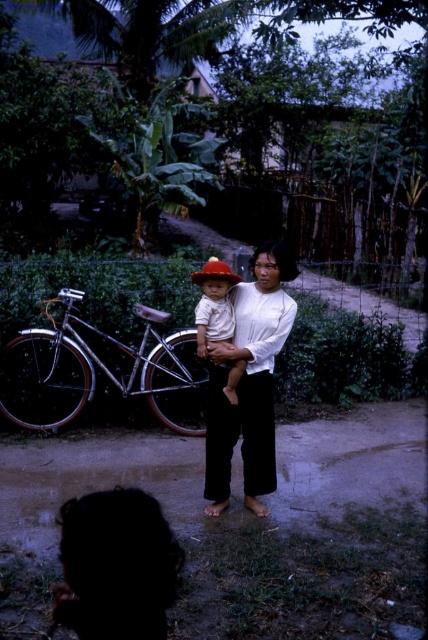
Does silky black hair at lower left appear over matte white blouse at center?

Incorrect, silky black hair at lower left is not positioned above matte white blouse at center.

Is point (122, 614) farther from viewer compared to point (250, 433)?

No.

Does point (146, 620) lie behind point (288, 253)?

No, it is not.

Where is `silky black hair at lower left`? silky black hair at lower left is located at coordinates (115, 564).

Who is more distant from viewer, (275, 294) or (229, 284)?

Positioned behind is point (229, 284).

Which is in front, point (294, 262) or point (234, 324)?

Point (294, 262) is more forward.

Where is `matte white blouse at center`? The height and width of the screenshot is (640, 428). matte white blouse at center is located at coordinates (249, 381).

Is silky black hair at lower left further to camera compared to white cotton shirt at center?

No, it is in front of white cotton shirt at center.

Can you confirm if silky black hair at lower left is positioned below white cotton shirt at center?

Yes, silky black hair at lower left is below white cotton shirt at center.

What do you see at coordinates (115, 564) in the screenshot?
I see `silky black hair at lower left` at bounding box center [115, 564].

Where is `silky black hair at lower left`? This screenshot has height=640, width=428. silky black hair at lower left is located at coordinates (115, 564).